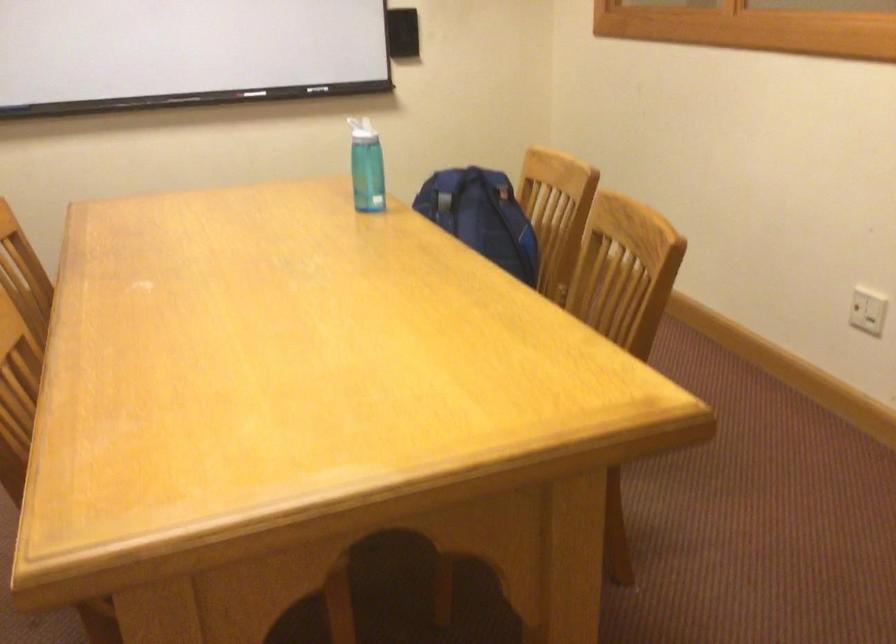
Identify the location of backpack top handle. (481, 216).